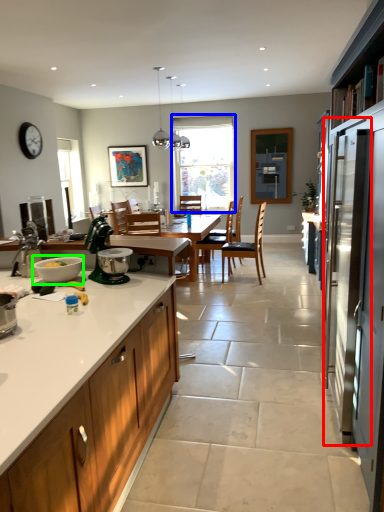
Question: Which is farther away from screen door (highlighted by a red box)? window (highlighted by a blue box) or mixing bowl (highlighted by a green box)?

Choices:
 (A) window
 (B) mixing bowl

Answer: (A)